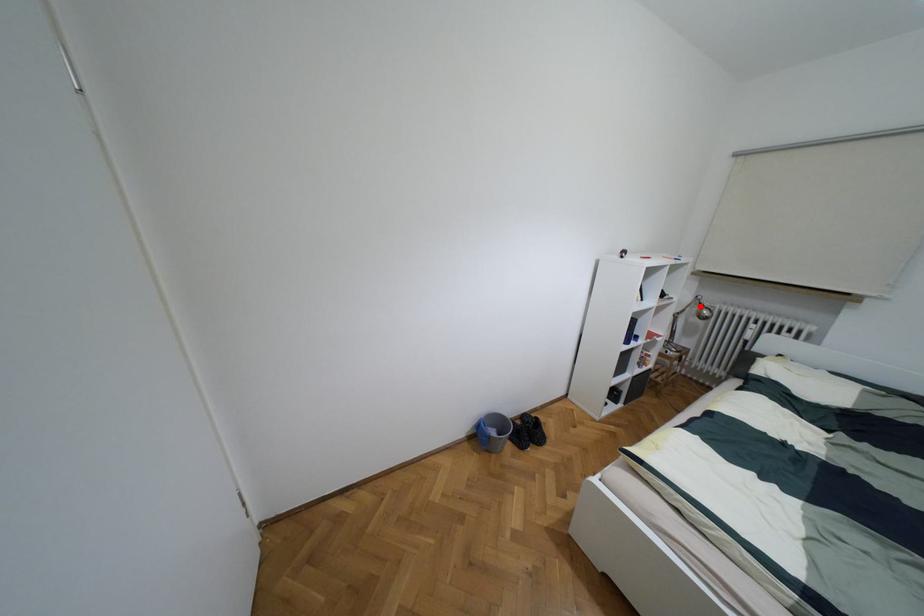
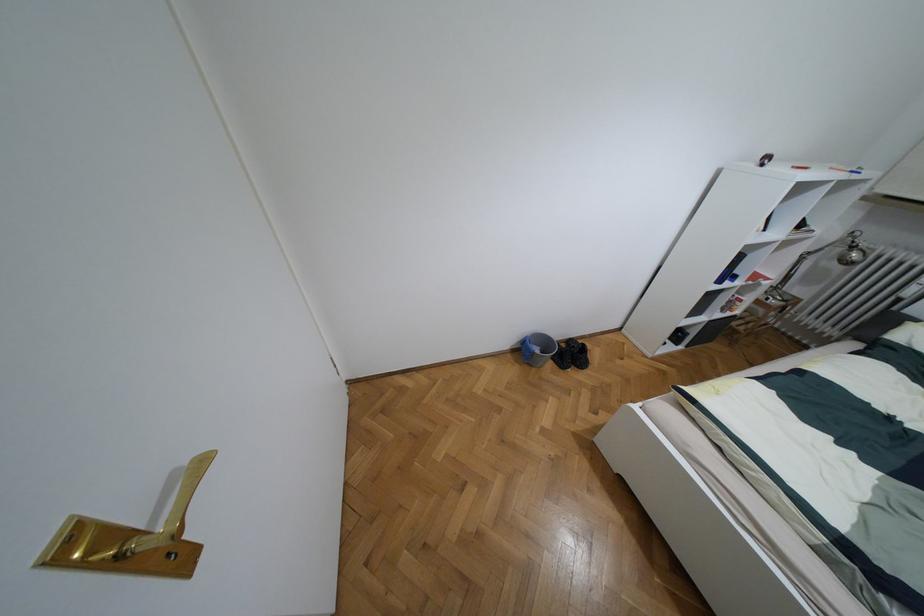
Question: I am providing you with two images of the same scene from different viewpoints. A red point is marked on the first image. Is the red point's position out of view in image 2?

Choices:
 (A) Yes
 (B) No

Answer: (B)